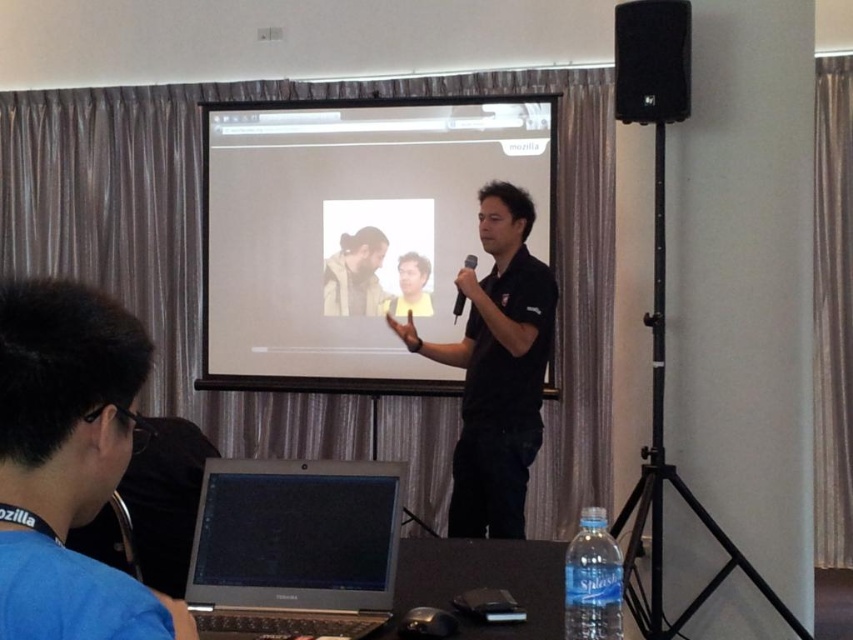
You are organizing a conference and need to place a name tag on the table. The name tag is as wide as the blue fabric shirt at lower left. Will it fit on the silver metallic laptop at lower center without overlapping the edges?

The blue fabric shirt at lower left is narrower than the silver metallic laptop at lower center, so the name tag will fit on the laptop without overlapping the edges.

You are organizing an event and need to know which object is larger between the matte white projector screen at center and the black matte speaker at upper right. Can you tell me which one is bigger?

The matte white projector screen at center is bigger than the black matte speaker at upper right according to the description.